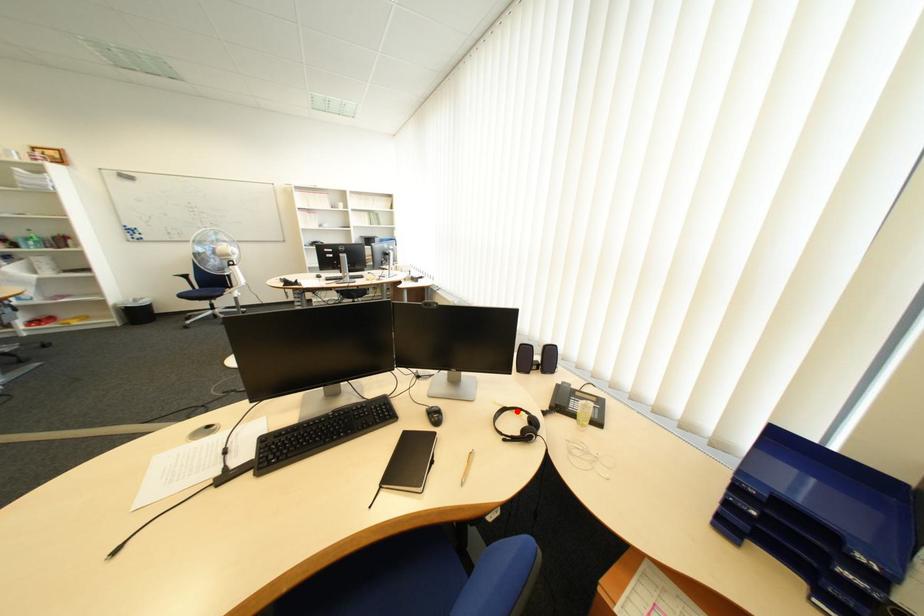
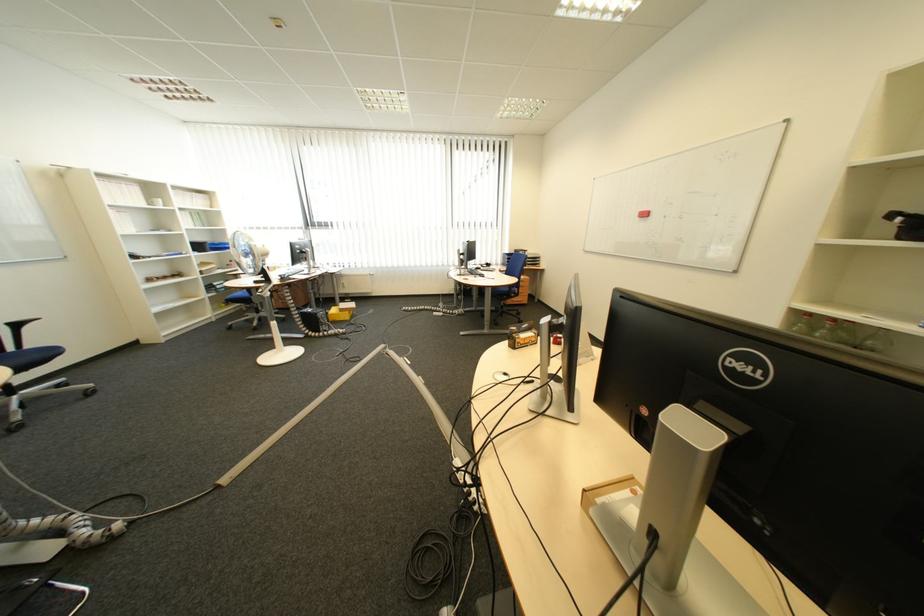
Question: I am providing you with two images of the same scene from different viewpoints. A red point is marked on the first image. Can you still see the location of the red point in image 2?

Choices:
 (A) Yes
 (B) No

Answer: (B)